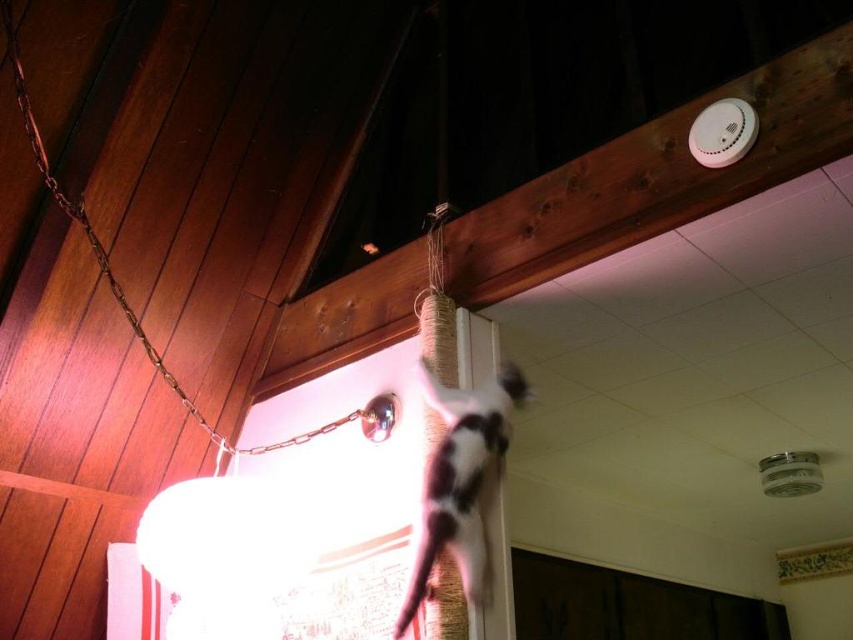
Question: Can you confirm if white fur cat at upper center is positioned below metallic chain at upper left?

Choices:
 (A) yes
 (B) no

Answer: (A)

Question: Does white fur cat at upper center come behind metallic chain at upper left?

Choices:
 (A) yes
 (B) no

Answer: (B)

Question: Which object appears farthest from the camera in this image?

Choices:
 (A) metallic chain at upper left
 (B) white fur cat at upper center

Answer: (A)

Question: Is white fur cat at upper center below metallic chain at upper left?

Choices:
 (A) no
 (B) yes

Answer: (B)

Question: Which point is farther from the camera taking this photo?

Choices:
 (A) (476, 432)
 (B) (335, 428)

Answer: (B)